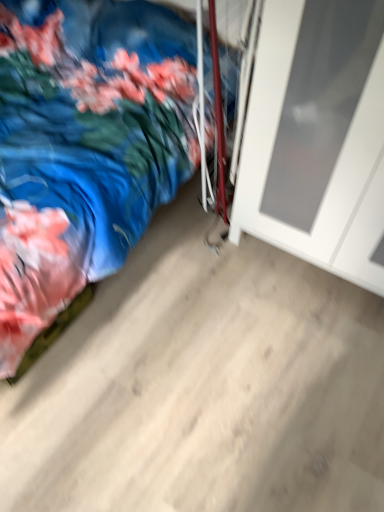
This screenshot has height=512, width=384. I want to click on blue satin bed at lower left, so click(x=84, y=151).

In order to face blue satin bed at lower left, should I rotate leftwards or rightwards?

Turn left approximately 18.168 degrees to face it.

Image resolution: width=384 pixels, height=512 pixels. Describe the element at coordinates (84, 151) in the screenshot. I see `blue satin bed at lower left` at that location.

This screenshot has height=512, width=384. I want to click on white matte door at right, so (317, 137).

The image size is (384, 512). Describe the element at coordinates (317, 137) in the screenshot. I see `white matte door at right` at that location.

The image size is (384, 512). In order to click on blue satin bed at lower left in this screenshot , I will do `click(84, 151)`.

Which object is positioned more to the left, blue satin bed at lower left or white matte door at right?

blue satin bed at lower left.

Considering the relative positions of blue satin bed at lower left and white matte door at right in the image provided, is blue satin bed at lower left in front of white matte door at right?

Yes, blue satin bed at lower left is closer to the camera.

Which is farther, (x=35, y=278) or (x=264, y=221)?

The point (x=264, y=221) is farther from the camera.

From the image's perspective, is blue satin bed at lower left beneath white matte door at right?

Incorrect, from the image's perspective, blue satin bed at lower left is higher than white matte door at right.

From a real-world perspective, between blue satin bed at lower left and white matte door at right, who is vertically higher?

In real-world perspective, white matte door at right is above.

From the picture: Is blue satin bed at lower left wider than white matte door at right?

Yes.

Who is shorter, blue satin bed at lower left or white matte door at right?

Standing shorter between the two is blue satin bed at lower left.

Can you confirm if blue satin bed at lower left is smaller than white matte door at right?

No, blue satin bed at lower left is not smaller than white matte door at right.

Does blue satin bed at lower left contain white matte door at right?

That's incorrect, white matte door at right is not inside blue satin bed at lower left.

Is blue satin bed at lower left far away from white matte door at right?

No, there isn't a large distance between blue satin bed at lower left and white matte door at right.

Could you tell me if blue satin bed at lower left is turned towards white matte door at right?

Yes.

How different are the orientations of blue satin bed at lower left and white matte door at right in degrees?

There is a 89.4-degree angle between the facing directions of blue satin bed at lower left and white matte door at right.

The width and height of the screenshot is (384, 512). In order to click on door that appears behind the blue satin bed at lower left in this screenshot , I will do `click(317, 137)`.

Which object is positioned more to the left, white matte door at right or blue satin bed at lower left?

Positioned to the left is blue satin bed at lower left.

Based on the photo, is white matte door at right in front of or behind blue satin bed at lower left in the image?

Clearly, white matte door at right is behind blue satin bed at lower left.

Which point is more forward, (261, 137) or (182, 153)?

The point (261, 137) is in front.

From the image's perspective, is white matte door at right over blue satin bed at lower left?

No, from the image's perspective, white matte door at right is not above blue satin bed at lower left.

From a real-world perspective, between white matte door at right and blue satin bed at lower left, who is vertically higher?

white matte door at right is physically above.

Is white matte door at right thinner than blue satin bed at lower left?

Yes.

From their relative heights in the image, would you say white matte door at right is taller or shorter than blue satin bed at lower left?

In the image, white matte door at right appears to be taller than blue satin bed at lower left.

Looking at the image, does white matte door at right seem bigger or smaller compared to blue satin bed at lower left?

white matte door at right is smaller than blue satin bed at lower left.

Does white matte door at right contain blue satin bed at lower left?

No, blue satin bed at lower left is located outside of white matte door at right.

Are white matte door at right and blue satin bed at lower left far apart?

No, white matte door at right is in close proximity to blue satin bed at lower left.

Is white matte door at right aimed at blue satin bed at lower left?

No, white matte door at right does not turn towards blue satin bed at lower left.

What's the angular difference between white matte door at right and blue satin bed at lower left's facing directions?

89.4 degrees separate the facing orientations of white matte door at right and blue satin bed at lower left.

Find the location of a particular element. This screenshot has width=384, height=512. bed to the left of white matte door at right is located at coordinates (84, 151).

Locate an element on the screen. This screenshot has width=384, height=512. bed above the white matte door at right (from the image's perspective) is located at coordinates (84, 151).

Where is `door below the blue satin bed at lower left (from the image's perspective)`? Image resolution: width=384 pixels, height=512 pixels. door below the blue satin bed at lower left (from the image's perspective) is located at coordinates (317, 137).